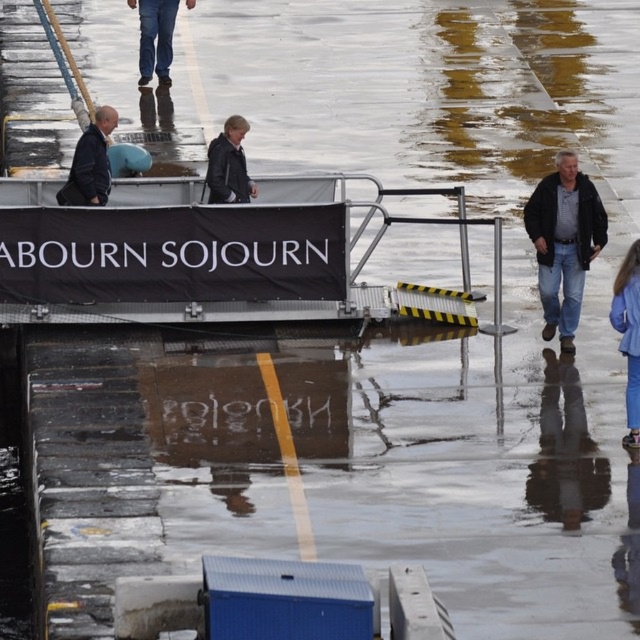
You are standing at the center of the dock and see the denim jacket at right and the dark gray leather jacket at center. Which jacket is closer to the ground?

The denim jacket at right is below dark gray leather jacket at center, so the denim jacket at right is closer to the ground.

You are standing at the center of the dock and see the blue denim jeans at lower right. If you want to walk directly towards them, in which direction should you move?

Since the blue denim jeans at lower right are located at point 0.523 on the x axis and 0.983 on the y axis, you should move towards the lower right direction to reach them.